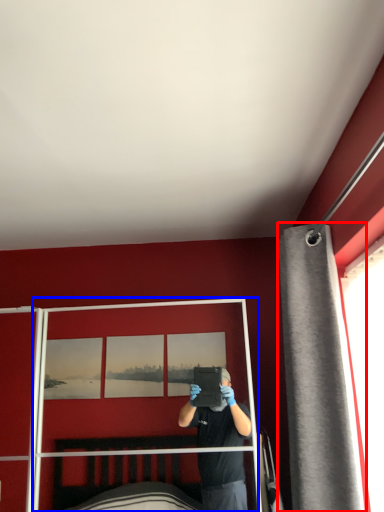
Question: Which of the following is the closest to the observer, curtain (highlighted by a red box) or screen door (highlighted by a blue box)?

Choices:
 (A) curtain
 (B) screen door

Answer: (A)